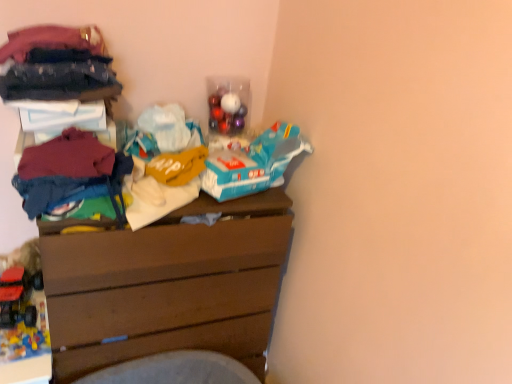
You are a GUI agent. You are given a task and a screenshot of the screen. Output one action in this format:
    pyautogui.click(x=<x>, y=<y>)
    Task: Click on the vacant location below rubberized plastic toy truck at lower left, acting as the first toy starting from the top (from a real-world perspective)
    This screenshot has height=384, width=512.
    Given the screenshot: What is the action you would take?
    pyautogui.click(x=15, y=313)